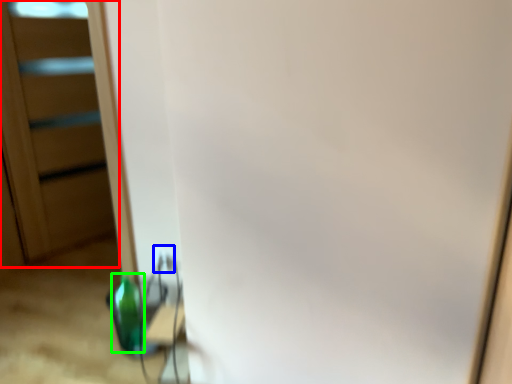
Question: Considering the real-world distances, which object is farthest from screen door (highlighted by a red box)? electric outlet (highlighted by a blue box) or bottle (highlighted by a green box)?

Choices:
 (A) electric outlet
 (B) bottle

Answer: (A)